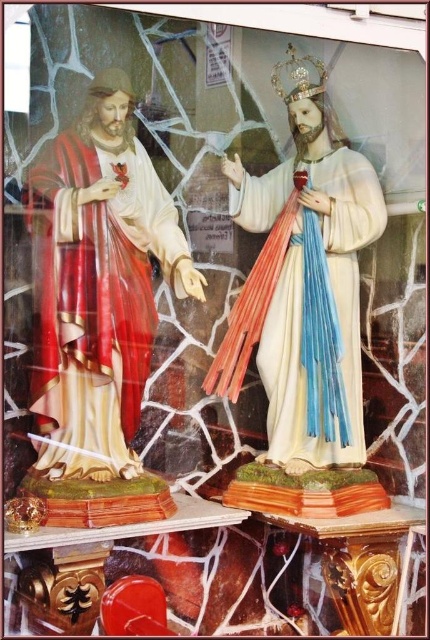
Question: Which point is farther to the camera?

Choices:
 (A) gold metallic crown at upper center
 (B) shiny red fabric robe at left
 (C) white glossy robe at center

Answer: (A)

Question: Estimate the real-world distances between objects in this image. Which object is farther from the white glossy robe at center?

Choices:
 (A) shiny red fabric robe at left
 (B) gold metallic crown at upper center

Answer: (B)

Question: Considering the real-world distances, which object is farthest from the white glossy robe at center?

Choices:
 (A) gold metallic crown at upper center
 (B) shiny red fabric robe at left

Answer: (A)

Question: Is shiny red fabric robe at left to the left of gold metallic crown at upper center from the viewer's perspective?

Choices:
 (A) no
 (B) yes

Answer: (B)

Question: Is white glossy robe at center below gold metallic crown at upper center?

Choices:
 (A) yes
 (B) no

Answer: (A)

Question: Can you confirm if shiny red fabric robe at left is smaller than white glossy robe at center?

Choices:
 (A) no
 (B) yes

Answer: (B)